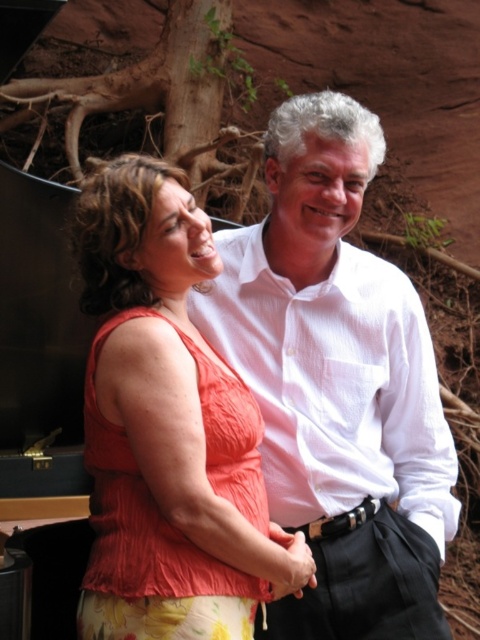
Which of these two, orange fabric top at center or white textured shirt at center, stands taller?

orange fabric top at center is taller.

Can you confirm if orange fabric top at center is positioned below white textured shirt at center?

Actually, orange fabric top at center is above white textured shirt at center.

Is point (132, 284) less distant than point (367, 253)?

Yes, it is in front of point (367, 253).

Locate an element on the screen. orange fabric top at center is located at coordinates (167, 428).